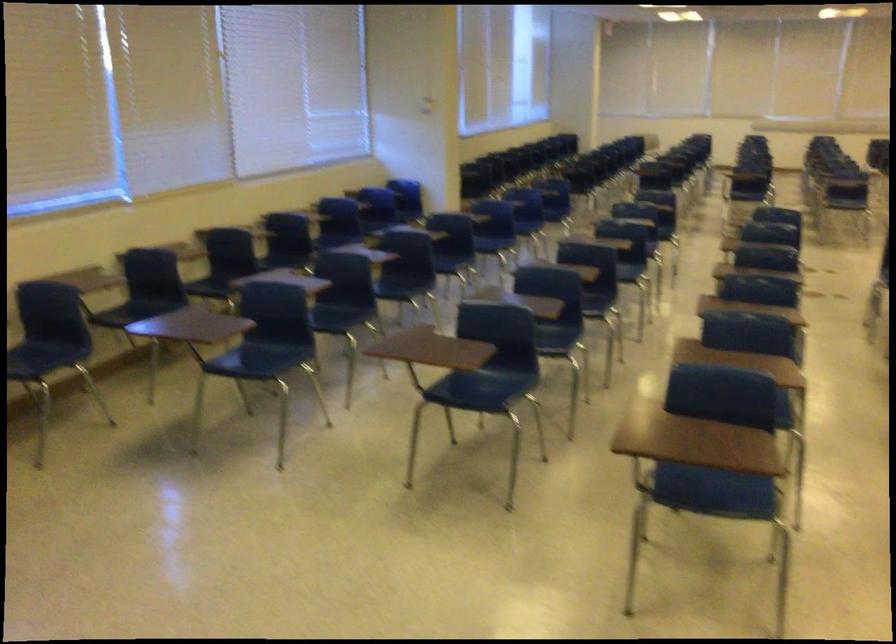
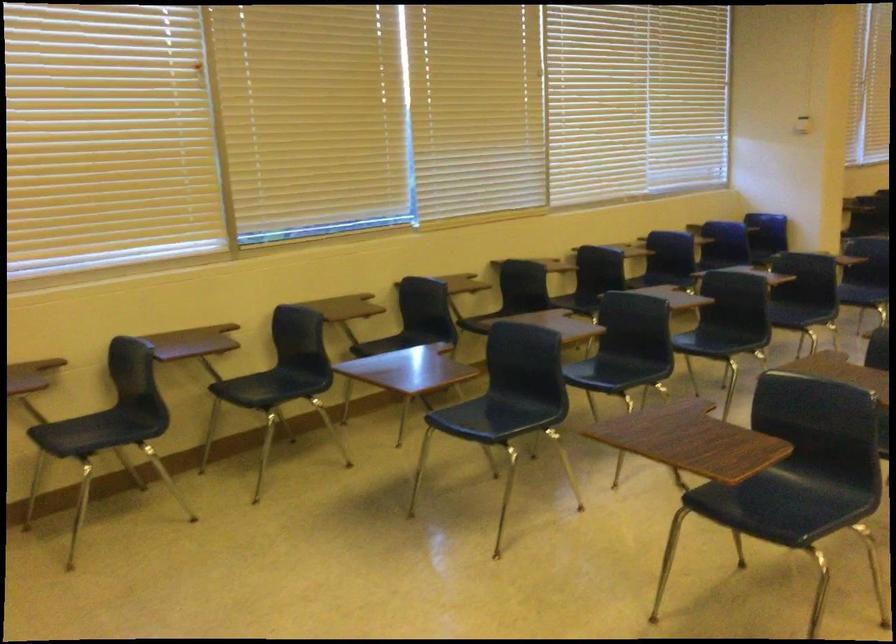
Question: The first image is from the beginning of the video and the second image is from the end. How did the camera likely rotate when shooting the video?

Choices:
 (A) Left
 (B) Right
 (C) Up
 (D) Down

Answer: (A)